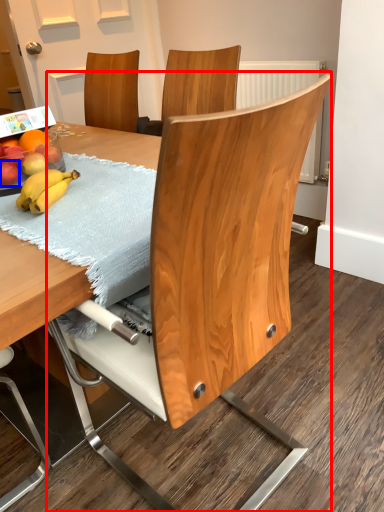
Question: Which point is further to the camera, chair (highlighted by a red box) or apple (highlighted by a blue box)?

Choices:
 (A) chair
 (B) apple

Answer: (B)